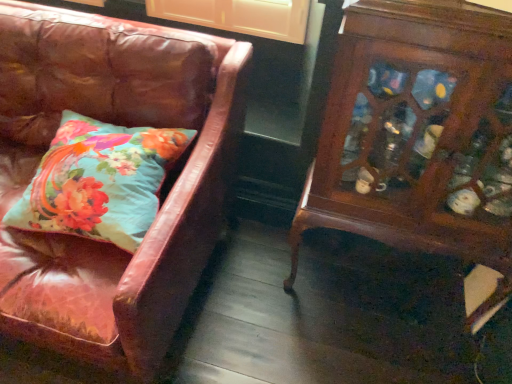
This screenshot has width=512, height=384. What are the coordinates of `vacant area situated to the left side of wooden cabinet at right` in the screenshot? It's located at (267, 303).